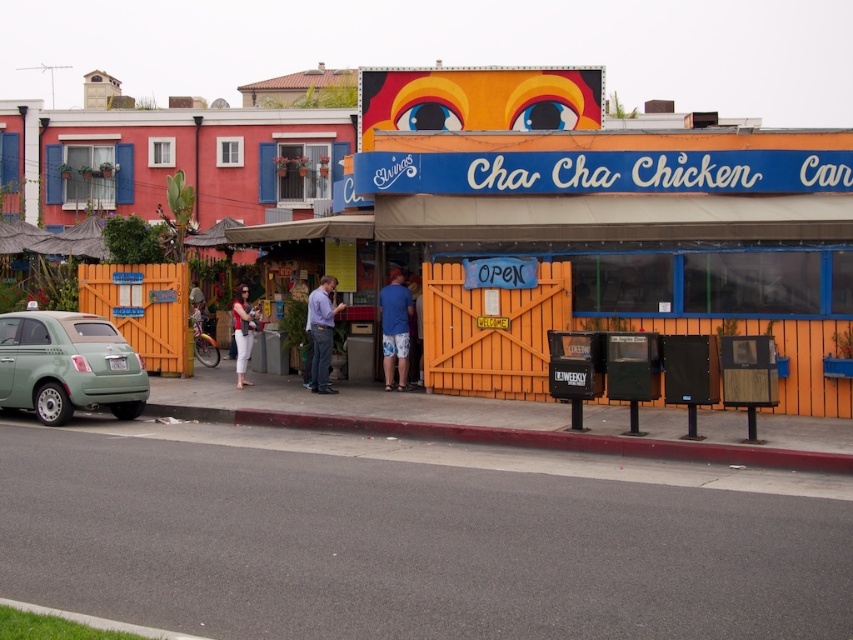
Consider the image. You are a delivery person approaching the entrance of Cha Cha Chicken Car. You notice a red rubber curb at lower center and matte white pants at center. Which object is smaller in size?

The red rubber curb at lower center is smaller than matte white pants at center.

You are standing at the entrance of the eatery and see the point marked as point [67,365]. What object does this point correspond to?

The point [67,365] corresponds to the matte green car at lower left.

You are a delivery person approaching the entrance of Cha Cha Chicken Car. You see the red rubber curb at lower center and the matte white pants at center. Which object is closer to the entrance?

The red rubber curb at lower center is closer to the entrance because it is in front of the matte white pants at center.